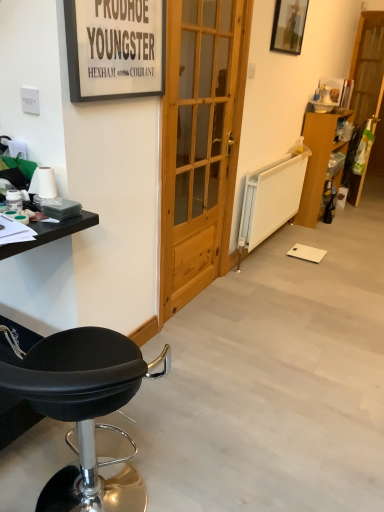
Where is `wooden screen door at right`? The image size is (384, 512). wooden screen door at right is located at coordinates (368, 66).

This screenshot has width=384, height=512. What do you see at coordinates (82, 409) in the screenshot? I see `black leather stool at lower left` at bounding box center [82, 409].

What do you see at coordinates (15, 417) in the screenshot? I see `black matte table at left` at bounding box center [15, 417].

Locate an element on the screen. The image size is (384, 512). matte black picture frame at upper left, marked as the first picture frame in a left-to-right arrangement is located at coordinates (115, 48).

What are the coordinates of `natural wood door at center` in the screenshot? It's located at [x=200, y=141].

Is point (162, 88) positioned after point (86, 345)?

Yes.

From the image's perspective, which is above, matte black picture frame at upper left, positioned as the second picture frame in top-to-bottom order, or black leather stool at lower left?

matte black picture frame at upper left, positioned as the second picture frame in top-to-bottom order.

Considering their positions, is matte black picture frame at upper left, positioned as the second picture frame in top-to-bottom order, located in front of or behind black leather stool at lower left?

In the image, matte black picture frame at upper left, positioned as the second picture frame in top-to-bottom order, appears behind black leather stool at lower left.

The width and height of the screenshot is (384, 512). Identify the location of chair to the left of matte black picture frame at upper left, the 1th picture frame viewed from the front. (82, 409).

How different are the orientations of black leather stool at lower left and wooden picture frame at upper right, which is the second picture frame from front to back, in degrees?

black leather stool at lower left and wooden picture frame at upper right, which is the second picture frame from front to back, are facing 89.5 degrees away from each other.

From a real-world perspective, which is physically below, black leather stool at lower left or wooden picture frame at upper right, arranged as the 1th picture frame when viewed from the right?

black leather stool at lower left.

Considering the relative sizes of black leather stool at lower left and wooden picture frame at upper right, which is the second picture frame from front to back, in the image provided, is black leather stool at lower left smaller than wooden picture frame at upper right, which is the second picture frame from front to back,?

Actually, black leather stool at lower left might be larger than wooden picture frame at upper right, which is the second picture frame from front to back.

Which object is positioned more to the left, black leather stool at lower left or wooden picture frame at upper right, arranged as the 1th picture frame when viewed from the right?

From the viewer's perspective, black leather stool at lower left appears more on the left side.

Between wooden cabinet at right and natural wood door at center, which one has more height?

natural wood door at center.

From the image's perspective, which one is positioned lower, wooden cabinet at right or natural wood door at center?

natural wood door at center appears lower in the image.

Is wooden cabinet at right to the left or to the right of natural wood door at center in the image?

Clearly, wooden cabinet at right is on the right of natural wood door at center in the image.

Is wooden cabinet at right not near natural wood door at center?

Yes, wooden cabinet at right and natural wood door at center are quite far apart.

Consider the image. Is natural wood door at center situated inside black matte table at left or outside?

natural wood door at center is spatially situated outside black matte table at left.

Considering the sizes of objects natural wood door at center and black matte table at left in the image provided, who is thinner, natural wood door at center or black matte table at left?

natural wood door at center is thinner.

From the image's perspective, is natural wood door at center located above or below black matte table at left?

natural wood door at center is situated higher than black matte table at left in the image.

Who is bigger, natural wood door at center or black matte table at left?

black matte table at left is bigger.

Is black matte table at left touching black leather stool at lower left?

No, black matte table at left is not touching black leather stool at lower left.

Is black matte table at left to the left of black leather stool at lower left from the viewer's perspective?

Yes, black matte table at left is to the left of black leather stool at lower left.

Could you tell me if black matte table at left is facing black leather stool at lower left?

No.

Is point (58, 224) positioned after point (125, 489)?

No, it is in front of (125, 489).

From the image's perspective, is wooden picture frame at upper right, arranged as the 1th picture frame when viewed from the right, above or below wooden screen door at right?

Based on their image positions, wooden picture frame at upper right, arranged as the 1th picture frame when viewed from the right, is located above wooden screen door at right.

Is point (279, 39) behind point (371, 81)?

No.

Relative to wooden screen door at right, is wooden picture frame at upper right, arranged as the 1th picture frame when viewed from the right, in front or behind?

wooden picture frame at upper right, arranged as the 1th picture frame when viewed from the right, is positioned closer to the viewer than wooden screen door at right.

Based on the photo, is black matte table at left facing away from wooden screen door at right?

No, black matte table at left is not facing away from wooden screen door at right.

Is black matte table at left not inside wooden screen door at right?

Absolutely, black matte table at left is external to wooden screen door at right.

From the image's perspective, which one is positioned higher, black matte table at left or wooden screen door at right?

wooden screen door at right.

Is black matte table at left not near wooden screen door at right?

That's right, there is a large distance between black matte table at left and wooden screen door at right.

Identify the location of chair that is below the matte black picture frame at upper left, marked as the first picture frame in a left-to-right arrangement (from the image's perspective). Image resolution: width=384 pixels, height=512 pixels. (82, 409).

This screenshot has width=384, height=512. Identify the location of chair in front of the wooden picture frame at upper right, the 2th picture frame in the left-to-right sequence. (82, 409).

Considering their positions, is wooden cabinet at right positioned closer to wooden picture frame at upper right, arranged as the 1th picture frame when viewed from the right, than matte black picture frame at upper left, positioned as the second picture frame in top-to-bottom order?

wooden cabinet at right is closer to wooden picture frame at upper right, arranged as the 1th picture frame when viewed from the right.

Consider the image. Which object lies nearer to the anchor point natural wood door at center, black matte table at left or wooden cabinet at right?

black matte table at left.

Estimate the real-world distances between objects in this image. Which object is closer to wooden picture frame at upper right, positioned as the first picture frame in top-to-bottom order, wooden screen door at right or matte black picture frame at upper left, the 1th picture frame viewed from the front?

Based on the image, matte black picture frame at upper left, the 1th picture frame viewed from the front, appears to be nearer to wooden picture frame at upper right, positioned as the first picture frame in top-to-bottom order.

From the image, which object appears to be farther from black matte table at left, matte black picture frame at upper left, marked as the first picture frame in a bottom-to-top arrangement, or wooden cabinet at right?

wooden cabinet at right is positioned further to the anchor black matte table at left.

When comparing their distances from wooden picture frame at upper right, the 2th picture frame in the left-to-right sequence, does wooden screen door at right or natural wood door at center seem further?

The object further to wooden picture frame at upper right, the 2th picture frame in the left-to-right sequence, is wooden screen door at right.

Estimate the real-world distances between objects in this image. Which object is further from black leather stool at lower left, black matte table at left or wooden cabinet at right?

The object further to black leather stool at lower left is wooden cabinet at right.

From the image, which object appears to be nearer to wooden cabinet at right, natural wood door at center or wooden screen door at right?

The object closer to wooden cabinet at right is wooden screen door at right.

Estimate the real-world distances between objects in this image. Which object is further from black leather stool at lower left, natural wood door at center or wooden screen door at right?

Among the two, wooden screen door at right is located further to black leather stool at lower left.

In order to click on door between matte black picture frame at upper left, positioned as the second picture frame in top-to-bottom order, and black matte table at left vertically in this screenshot , I will do `click(200, 141)`.

The image size is (384, 512). In order to click on door between matte black picture frame at upper left, marked as the first picture frame in a left-to-right arrangement, and black leather stool at lower left in the up-down direction in this screenshot , I will do `click(200, 141)`.

Locate an element on the screen. picture frame that lies between wooden picture frame at upper right, the 2th picture frame in the left-to-right sequence, and black matte table at left from top to bottom is located at coordinates (115, 48).

Where is `picture frame between matte black picture frame at upper left, marked as the first picture frame in a left-to-right arrangement, and wooden screen door at right from front to back`? picture frame between matte black picture frame at upper left, marked as the first picture frame in a left-to-right arrangement, and wooden screen door at right from front to back is located at coordinates (288, 26).